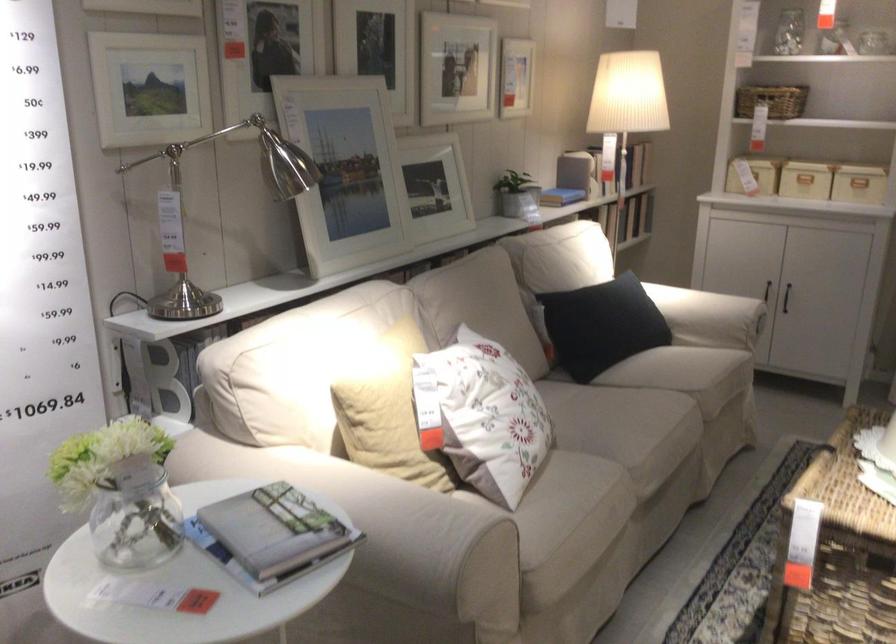
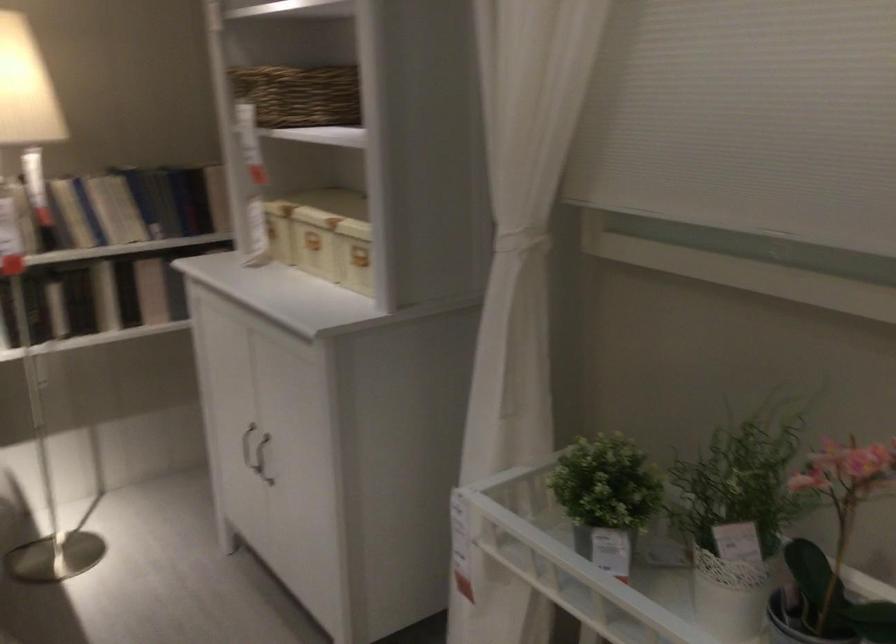
Where in the second image is the point corresponding to the point at 632,205 from the first image?

(151, 290)